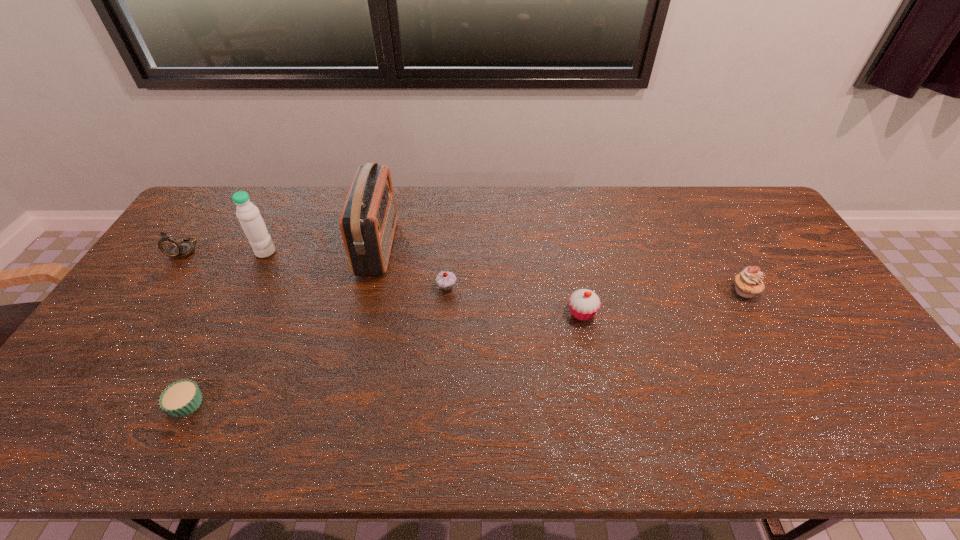
Where is `free space that satisfies the following two spatial constraints: 1. on the front-facing side of the second cupcake from left to right; 2. on the right side of the fourth object from left to right`? This screenshot has height=540, width=960. free space that satisfies the following two spatial constraints: 1. on the front-facing side of the second cupcake from left to right; 2. on the right side of the fourth object from left to right is located at coordinates (369, 287).

The image size is (960, 540). What are the coordinates of `blank space that satisfies the following two spatial constraints: 1. on the front-facing side of the radio receiver; 2. on the back side of the third cupcake from right to left` in the screenshot? It's located at (369, 287).

Find the location of `free location that satisfies the following two spatial constraints: 1. on the front-facing side of the fifth object from left to right; 2. on the left side of the radio receiver`. free location that satisfies the following two spatial constraints: 1. on the front-facing side of the fifth object from left to right; 2. on the left side of the radio receiver is located at coordinates (369, 287).